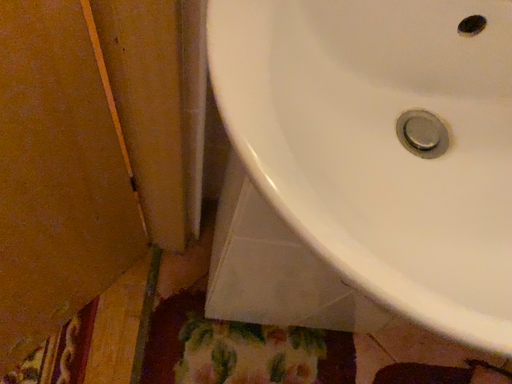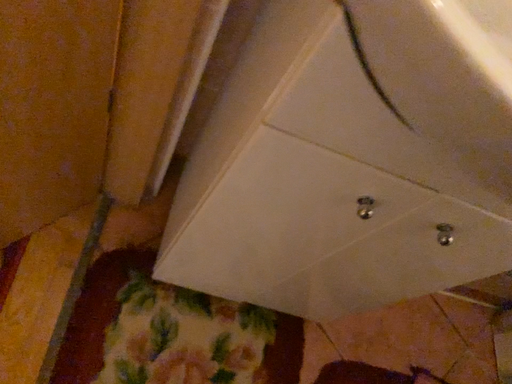
Question: How did the camera likely rotate when shooting the video?

Choices:
 (A) rotated left
 (B) rotated right

Answer: (B)